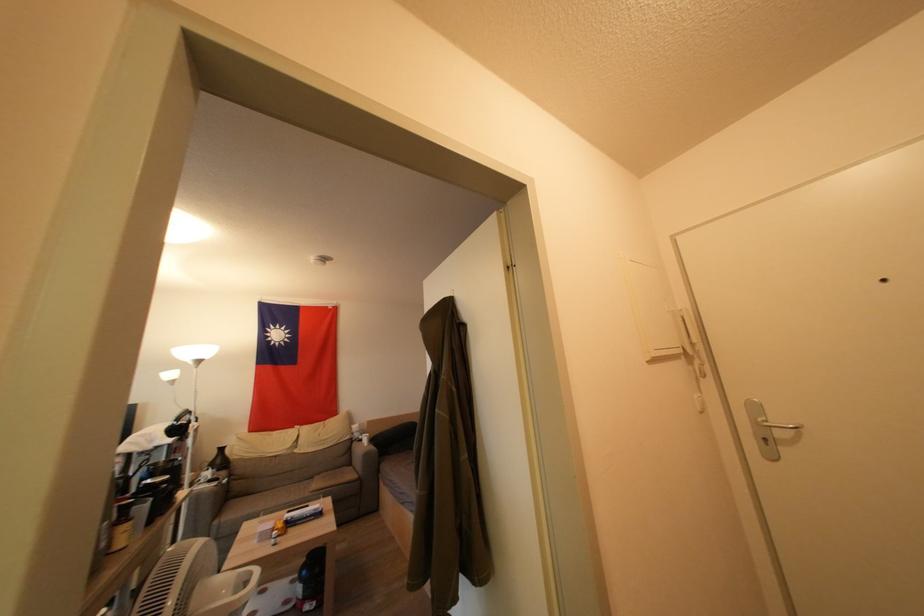
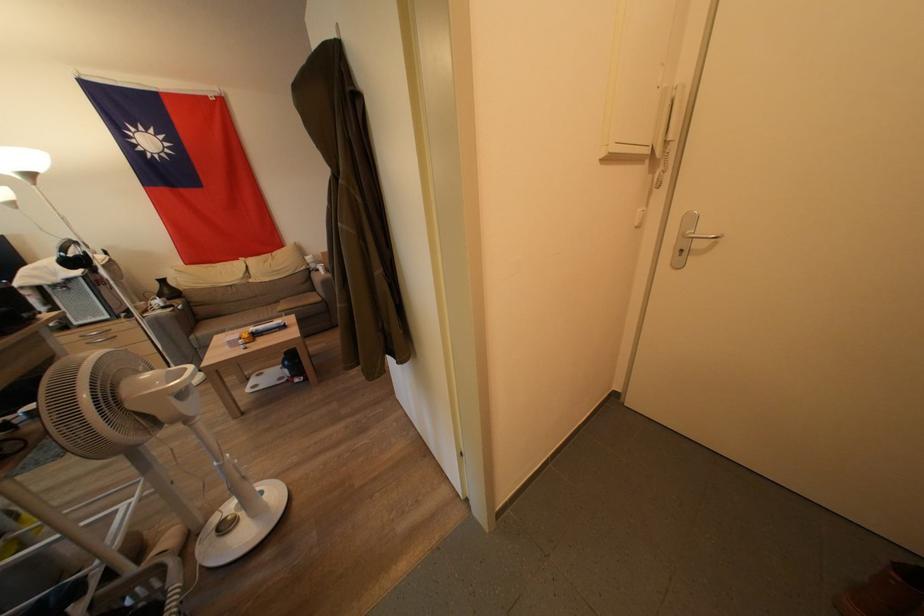
In the second image, find the point that corresponds to point 193,416 in the first image.

(79, 246)